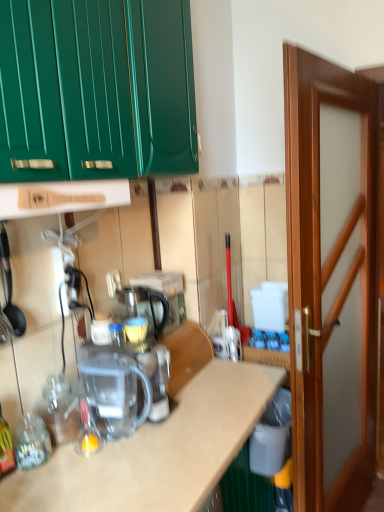
What are the coordinates of `wooden at center` in the screenshot? It's located at (156, 451).

The image size is (384, 512). Describe the element at coordinates (156, 451) in the screenshot. I see `wooden at center` at that location.

In order to face translucent glass bottle at lower left, which is the second bottle from back to front, should I rotate leftwards or rightwards?

Turn left by 24.179 degrees to look at translucent glass bottle at lower left, which is the second bottle from back to front.

The image size is (384, 512). In order to click on translucent glass bottle at lower left, which is the second bottle from back to front in this screenshot , I will do `click(5, 448)`.

Describe the element at coordinates (115, 393) in the screenshot. I see `transparent plastic coffee machine at center` at that location.

Where is `wooden at center`? This screenshot has height=512, width=384. wooden at center is located at coordinates click(156, 451).

Is wooden at center behind transparent plastic coffee machine at center?

That is False.

Considering the points (204, 401) and (126, 416), which point is behind, point (204, 401) or point (126, 416)?

The point (204, 401) is farther from the camera.

Measure the distance from wooden at center to transparent plastic coffee machine at center.

wooden at center is 7.78 inches from transparent plastic coffee machine at center.

Does wooden at center have a greater height compared to transparent plastic coffee machine at center?

Indeed, wooden at center has a greater height compared to transparent plastic coffee machine at center.

Is transparent plastic bottle at lower left, which is counted as the 1th bottle, starting from the right, behind wooden door at right?

Yes.

Which is correct: transparent plastic bottle at lower left, which is counted as the 1th bottle, starting from the right, is inside wooden door at right, or outside of it?

transparent plastic bottle at lower left, which is counted as the 1th bottle, starting from the right, is not inside wooden door at right, it's outside.

At what (x,y) coordinates should I click in order to perform the action: click on door on the right of transparent plastic bottle at lower left, the 2th bottle viewed from the front. Please return your answer as a coordinate pair (x, y). Looking at the image, I should click on (331, 278).

Visually, is transparent plastic bottle at lower left, which is counted as the 1th bottle, starting from the right, positioned to the left or to the right of wooden door at right?

transparent plastic bottle at lower left, which is counted as the 1th bottle, starting from the right, is to the left of wooden door at right.

Are wooden at center and wooden door at right far apart?

No, wooden at center is not far away from wooden door at right.

Considering the sizes of wooden at center and wooden door at right in the image, is wooden at center taller or shorter than wooden door at right?

In the image, wooden at center appears to be shorter than wooden door at right.

Is wooden at center to the right of wooden door at right from the viewer's perspective?

Incorrect, wooden at center is not on the right side of wooden door at right.

Considering their positions, is wooden at center located in front of or behind wooden door at right?

wooden at center is behind wooden door at right.

From the image's perspective, which one is positioned lower, transparent plastic bottle at lower left, the second bottle in the left-to-right sequence, or translucent glass bottle at lower left, the first bottle when ordered from left to right?

translucent glass bottle at lower left, the first bottle when ordered from left to right.

Is transparent plastic bottle at lower left, which is counted as the 1th bottle, starting from the right, placed right next to translucent glass bottle at lower left, placed as the first bottle when sorted from front to back?

No, transparent plastic bottle at lower left, which is counted as the 1th bottle, starting from the right, is not beside translucent glass bottle at lower left, placed as the first bottle when sorted from front to back.

What are the coordinates of `bottle positioned vertically above the transparent plastic bottle at lower left, which is counted as the 1th bottle, starting from the right (from a real-world perspective)` in the screenshot? It's located at (5, 448).

Is transparent plastic bottle at lower left, which is counted as the 1th bottle, starting from the right, oriented towards translucent glass bottle at lower left, placed as the first bottle when sorted from front to back?

No, transparent plastic bottle at lower left, which is counted as the 1th bottle, starting from the right, is not oriented towards translucent glass bottle at lower left, placed as the first bottle when sorted from front to back.

From the image's perspective, who appears lower, transparent plastic bottle at lower left, which is counted as the first bottle, starting from the back, or transparent plastic coffee machine at center?

transparent plastic bottle at lower left, which is counted as the first bottle, starting from the back, appears lower in the image.

Is transparent plastic bottle at lower left, the second bottle in the left-to-right sequence, far from transparent plastic coffee machine at center?

No, there isn't a large distance between transparent plastic bottle at lower left, the second bottle in the left-to-right sequence, and transparent plastic coffee machine at center.

From a real-world perspective, which is physically above, transparent plastic bottle at lower left, the 2th bottle viewed from the front, or transparent plastic coffee machine at center?

From a 3D spatial view, transparent plastic coffee machine at center is above.

Is transparent plastic coffee machine at center inside transparent plastic bottle at lower left, the second bottle in the left-to-right sequence?

No, transparent plastic coffee machine at center is not surrounded by transparent plastic bottle at lower left, the second bottle in the left-to-right sequence.

Is wooden door at right not inside transparent plastic bottle at lower left, which is counted as the first bottle, starting from the back?

→ Indeed, wooden door at right is completely outside transparent plastic bottle at lower left, which is counted as the first bottle, starting from the back.

Consider the image. Considering the sizes of objects wooden door at right and transparent plastic bottle at lower left, the 2th bottle viewed from the front, in the image provided, who is thinner, wooden door at right or transparent plastic bottle at lower left, the 2th bottle viewed from the front,?

Thinner between the two is transparent plastic bottle at lower left, the 2th bottle viewed from the front.

Is point (361, 507) less distant than point (69, 411)?

No, (361, 507) is behind (69, 411).

Find the location of a particular element. The width and height of the screenshot is (384, 512). appliance on the right of the translucent glass bottle at lower left, placed as the first bottle when sorted from front to back is located at coordinates [x=142, y=306].

Is point (128, 287) in front of point (5, 437)?

No, it is behind (5, 437).

Would you consider transparent plastic kettle at center to be distant from translucent glass bottle at lower left, marked as the second bottle in a right-to-left arrangement?

No, there isn't a large distance between transparent plastic kettle at center and translucent glass bottle at lower left, marked as the second bottle in a right-to-left arrangement.

Can you tell me how much transparent plastic kettle at center and translucent glass bottle at lower left, the first bottle when ordered from left to right, differ in facing direction?

2.37 degrees.

This screenshot has width=384, height=512. I want to click on coffee machine that appears behind the wooden at center, so click(x=115, y=393).

In order to click on the 1st bottle below the wooden door at right (from the image's perspective) in this screenshot , I will do `click(60, 409)`.

Consider the image. Which object lies further to the anchor point transparent plastic bottle at lower left, which is counted as the first bottle, starting from the back, wooden door at right or transparent plastic coffee machine at center?

Based on the image, wooden door at right appears to be further to transparent plastic bottle at lower left, which is counted as the first bottle, starting from the back.

Based on their spatial positions, is translucent glass bottle at lower left, which is the second bottle from back to front, or transparent plastic kettle at center further from wooden at center?

translucent glass bottle at lower left, which is the second bottle from back to front, lies further to wooden at center than the other object.

Which object lies nearer to the anchor point transparent plastic bottle at lower left, the 2th bottle viewed from the front, wooden door at right or transparent plastic kettle at center?

transparent plastic kettle at center is closer to transparent plastic bottle at lower left, the 2th bottle viewed from the front.

Based on their spatial positions, is transparent plastic coffee machine at center or wooden at center closer to transparent plastic bottle at lower left, which is counted as the 1th bottle, starting from the right?

The object closer to transparent plastic bottle at lower left, which is counted as the 1th bottle, starting from the right, is transparent plastic coffee machine at center.

Looking at the image, which one is located closer to transparent plastic bottle at lower left, the 2th bottle viewed from the front, wooden at center or transparent plastic coffee machine at center?

Among the two, transparent plastic coffee machine at center is located nearer to transparent plastic bottle at lower left, the 2th bottle viewed from the front.

From the image, which object appears to be farther from transparent plastic bottle at lower left, the second bottle in the left-to-right sequence, transparent plastic kettle at center or wooden at center?

transparent plastic kettle at center is further to transparent plastic bottle at lower left, the second bottle in the left-to-right sequence.

Which object lies further to the anchor point transparent plastic kettle at center, wooden door at right or translucent glass bottle at lower left, the first bottle when ordered from left to right?

Based on the image, wooden door at right appears to be further to transparent plastic kettle at center.

Estimate the real-world distances between objects in this image. Which object is further from wooden at center, wooden door at right or transparent plastic bottle at lower left, the second bottle in the left-to-right sequence?

The object further to wooden at center is wooden door at right.

Identify the location of coffee machine between transparent plastic kettle at center and wooden at center in the vertical direction. The width and height of the screenshot is (384, 512). (115, 393).

Find the location of a particular element. Image resolution: width=384 pixels, height=512 pixels. coffee machine between transparent plastic bottle at lower left, the 2th bottle viewed from the front, and wooden door at right, in the horizontal direction is located at coordinates (115, 393).

You are a GUI agent. You are given a task and a screenshot of the screen. Output one action in this format:
    pyautogui.click(x=<x>, y=<y>)
    Task: Click on the bottle located between translucent glass bottle at lower left, which is the second bottle from back to front, and wooden door at right in the left-right direction
    The width and height of the screenshot is (384, 512).
    Given the screenshot: What is the action you would take?
    pyautogui.click(x=60, y=409)

Identify the location of countertop situated between translucent glass bottle at lower left, which is the second bottle from back to front, and wooden door at right from left to right. The image size is (384, 512). (156, 451).